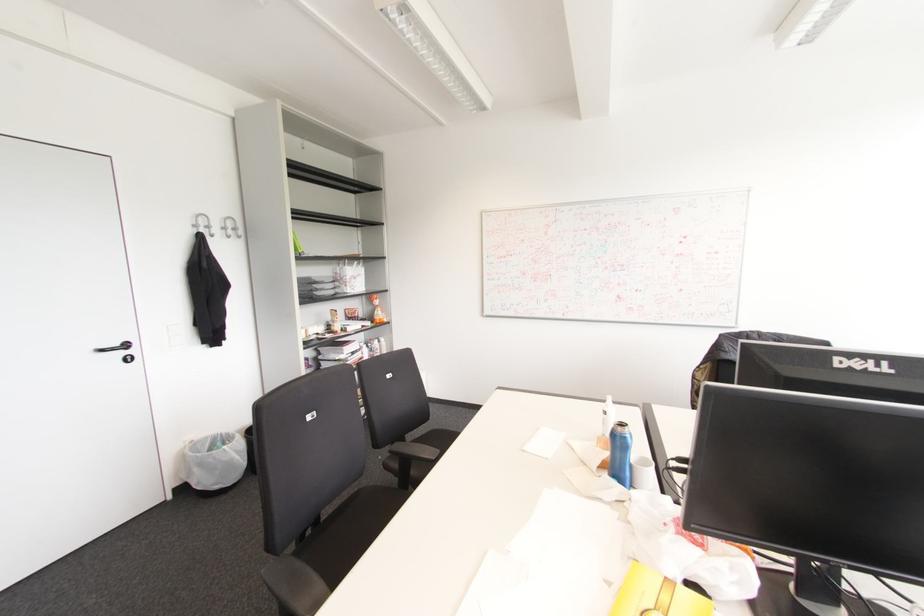
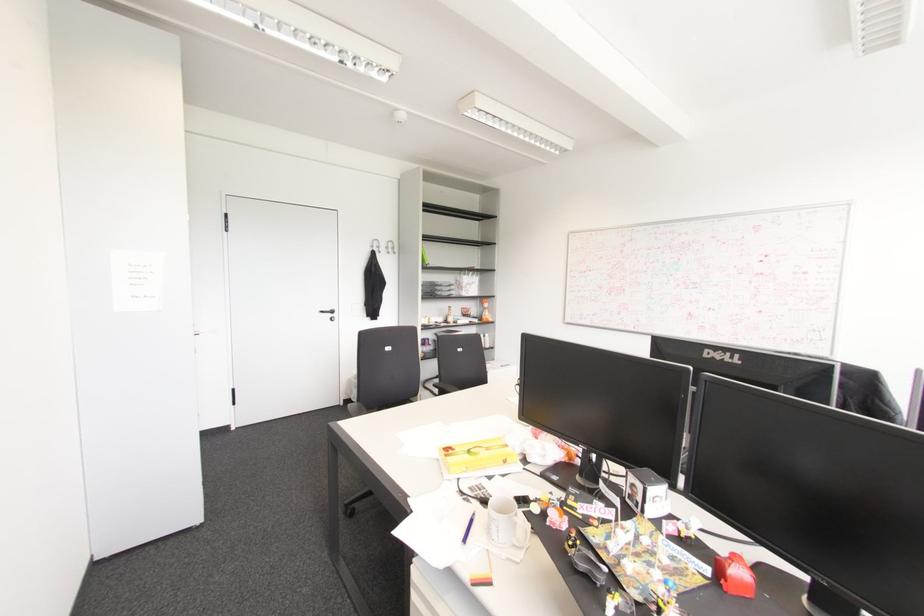
Where in the second image is the point corresponding to point (126, 345) from the first image?

(332, 310)